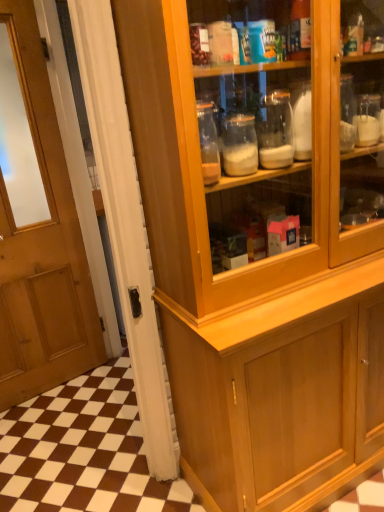
Question: Is wooden cabinet at lower right facing towards wooden door at left?

Choices:
 (A) no
 (B) yes

Answer: (A)

Question: From a real-world perspective, is wooden cabinet at lower right positioned over wooden door at left based on gravity?

Choices:
 (A) yes
 (B) no

Answer: (B)

Question: Is wooden cabinet at lower right surrounding wooden door at left?

Choices:
 (A) yes
 (B) no

Answer: (B)

Question: Is wooden cabinet at lower right not inside wooden door at left?

Choices:
 (A) no
 (B) yes

Answer: (B)

Question: Does wooden cabinet at lower right have a lesser width compared to wooden door at left?

Choices:
 (A) yes
 (B) no

Answer: (B)

Question: Is wooden cabinet at lower right to the left of wooden door at left from the viewer's perspective?

Choices:
 (A) no
 (B) yes

Answer: (A)

Question: Would you consider wooden door at left to be distant from wooden cabinet at lower right?

Choices:
 (A) yes
 (B) no

Answer: (A)

Question: Is wooden door at left closer to the viewer compared to wooden cabinet at lower right?

Choices:
 (A) yes
 (B) no

Answer: (A)

Question: Is the depth of wooden door at left greater than that of wooden cabinet at lower right?

Choices:
 (A) no
 (B) yes

Answer: (A)

Question: Is wooden door at left shorter than wooden cabinet at lower right?

Choices:
 (A) yes
 (B) no

Answer: (B)

Question: Considering the relative sizes of wooden door at left and wooden cabinet at lower right in the image provided, is wooden door at left thinner than wooden cabinet at lower right?

Choices:
 (A) no
 (B) yes

Answer: (B)

Question: Is wooden door at left at the right side of wooden cabinet at lower right?

Choices:
 (A) no
 (B) yes

Answer: (A)

Question: Considering the positions of wooden cabinet at lower right and wooden door at left in the image, is wooden cabinet at lower right bigger or smaller than wooden door at left?

Choices:
 (A) small
 (B) big

Answer: (B)